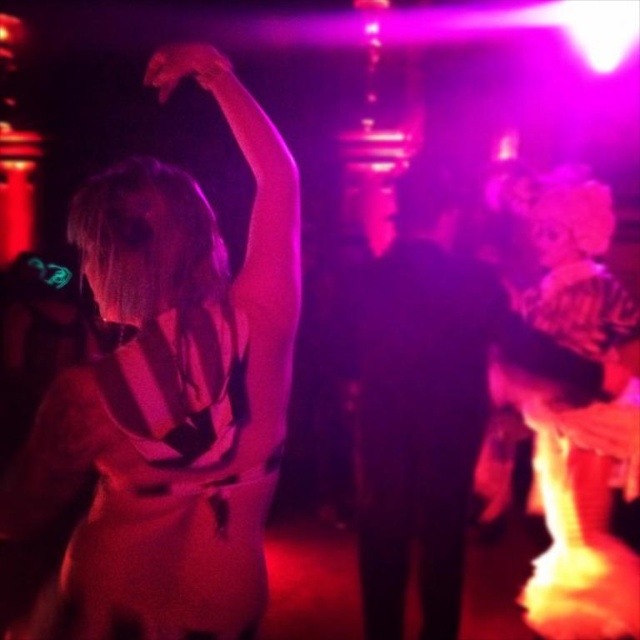
Can you confirm if matte white dress at upper left is taller than matte black hand at upper left?

Correct, matte white dress at upper left is much taller as matte black hand at upper left.

Which is behind, point (140, 636) or point (186, 45)?

Point (186, 45)

Looking at this image, who is more forward, (241, 595) or (147, 83)?

Positioned in front is point (241, 595).

Where is `matte white dress at upper left`? matte white dress at upper left is located at coordinates (170, 401).